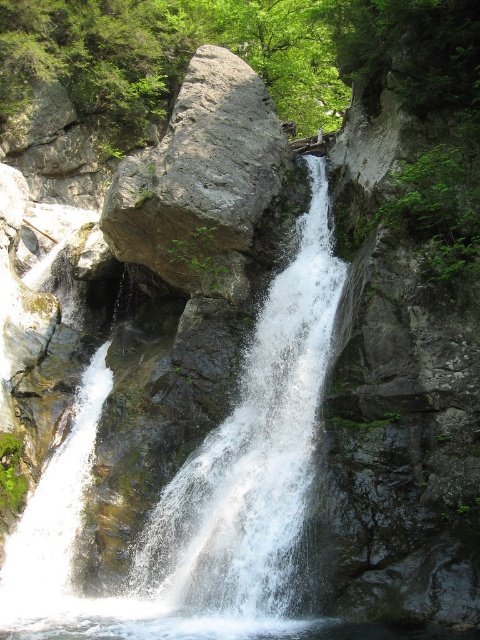
Question: Is white frothy water at center positioned in front of gray rock at center?

Choices:
 (A) yes
 (B) no

Answer: (A)

Question: Is white frothy water at center smaller than gray rock at center?

Choices:
 (A) yes
 (B) no

Answer: (A)

Question: Does white frothy water at center appear on the left side of gray rock at center?

Choices:
 (A) no
 (B) yes

Answer: (A)

Question: Which object appears farthest from the camera in this image?

Choices:
 (A) gray rock at center
 (B) white frothy water at center

Answer: (A)

Question: Which point appears closest to the camera in this image?

Choices:
 (A) (231, 529)
 (B) (142, 192)

Answer: (A)